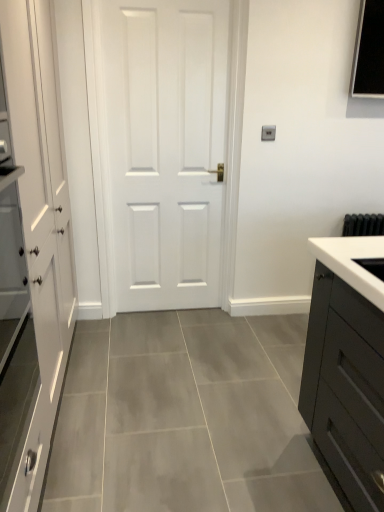
This screenshot has width=384, height=512. What do you see at coordinates (163, 146) in the screenshot? I see `white matte door at center` at bounding box center [163, 146].

The image size is (384, 512). Describe the element at coordinates (352, 262) in the screenshot. I see `white glossy sink at right` at that location.

Identify the location of white matte cabinet at left. (40, 217).

From the image's perspective, is white glossy sink at right located above or below white matte cabinet at left?

white glossy sink at right is situated lower than white matte cabinet at left in the image.

Based on the photo, which point is more distant from viewer, (381, 282) or (46, 17)?

The point (46, 17) is farther from the camera.

Would you say white glossy sink at right contains white matte cabinet at left?

Definitely not — white matte cabinet at left is not inside white glossy sink at right.

Who is more distant, white glossy sink at right or white matte door at center?

white glossy sink at right.

Would you say white glossy sink at right is outside white matte door at center?

white glossy sink at right lies outside white matte door at center's area.

Is white glossy sink at right next to white matte door at center?

No, white glossy sink at right is not touching white matte door at center.

Is white matte cabinet at left aimed at white glossy sink at right?

Yes, white matte cabinet at left is turned towards white glossy sink at right.

Is white matte cabinet at left in front of white glossy sink at right?

Yes, white matte cabinet at left is closer to the camera.

Consider the image. From the image's perspective, is white matte cabinet at left positioned above or below white glossy sink at right?

From the image's perspective, white matte cabinet at left appears above white glossy sink at right.

From the picture: Considering the sizes of objects white matte cabinet at left and white glossy sink at right in the image provided, who is smaller, white matte cabinet at left or white glossy sink at right?

With smaller size is white glossy sink at right.

Is white matte door at center far away from white matte cabinet at left?

Actually, white matte door at center and white matte cabinet at left are a little close together.

From the image's perspective, would you say white matte door at center is positioned over white matte cabinet at left?

Yes.

From a real-world perspective, who is located higher, white matte door at center or white matte cabinet at left?

white matte door at center.

Is white matte cabinet at left next to white matte door at center and touching it?

white matte cabinet at left and white matte door at center are not in contact.

Can you confirm if white matte cabinet at left is shorter than white matte door at center?

Yes, white matte cabinet at left is shorter than white matte door at center.

In the image, there is a white matte door at center. Where is `cabinetry below it (from the image's perspective)`? The width and height of the screenshot is (384, 512). cabinetry below it (from the image's perspective) is located at coordinates (40, 217).

How many degrees apart are the facing directions of white matte cabinet at left and white matte door at center?

89.6 degrees separate the facing orientations of white matte cabinet at left and white matte door at center.

Are white matte door at center and white glossy sink at right located far from each other?

Indeed, white matte door at center is not near white glossy sink at right.

From a real-world perspective, is white matte door at center over white glossy sink at right?

Yes, from a real-world perspective, white matte door at center is over white glossy sink at right

From the image's perspective, is white matte door at center located above white glossy sink at right?

Yes, from the image's perspective, white matte door at center is over white glossy sink at right.

Is white matte door at center further to camera compared to white glossy sink at right?

No, the depth of white matte door at center is less than that of white glossy sink at right.

This screenshot has height=512, width=384. What are the coordinates of `cabinetry on the left of white glossy sink at right` in the screenshot? It's located at (40, 217).

Where is `door lying above the white glossy sink at right (from the image's perspective)`? door lying above the white glossy sink at right (from the image's perspective) is located at coordinates (163, 146).

Considering their positions, is white matte door at center positioned further to white glossy sink at right than white matte cabinet at left?

white matte door at center lies further to white glossy sink at right than the other object.

When comparing their distances from white matte door at center, does white glossy sink at right or white matte cabinet at left seem further?

white glossy sink at right is further to white matte door at center.

Looking at the image, which one is located further to white matte door at center, white matte cabinet at left or white glossy sink at right?

Among the two, white glossy sink at right is located further to white matte door at center.

Consider the image. Which object lies further to the anchor point white glossy sink at right, white matte cabinet at left or white matte door at center?

Based on the image, white matte door at center appears to be further to white glossy sink at right.

Estimate the real-world distances between objects in this image. Which object is closer to white matte cabinet at left, white matte door at center or white glossy sink at right?

white matte door at center.

Looking at this image, considering their positions, is white glossy sink at right positioned further to white matte cabinet at left than white matte door at center?

Based on the image, white glossy sink at right appears to be further to white matte cabinet at left.

The height and width of the screenshot is (512, 384). What are the coordinates of `door located between white matte cabinet at left and white glossy sink at right in the depth direction` in the screenshot? It's located at (163, 146).